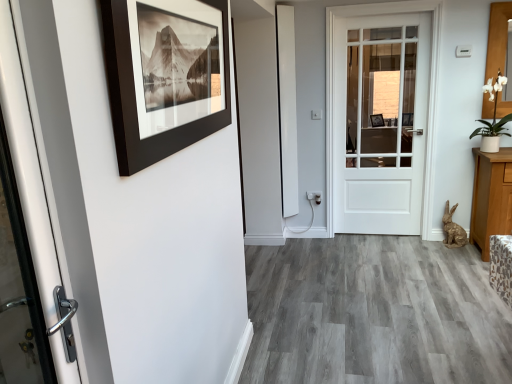
Question: From a real-world perspective, is white matte door at center located higher than black matte picture frame at upper left?

Choices:
 (A) yes
 (B) no

Answer: (B)

Question: Is white matte door at center facing away from black matte picture frame at upper left?

Choices:
 (A) yes
 (B) no

Answer: (B)

Question: Is white matte door at center bigger than black matte picture frame at upper left?

Choices:
 (A) no
 (B) yes

Answer: (B)

Question: Is the surface of white matte door at center in direct contact with black matte picture frame at upper left?

Choices:
 (A) no
 (B) yes

Answer: (A)

Question: Can you confirm if white matte door at center is taller than black matte picture frame at upper left?

Choices:
 (A) yes
 (B) no

Answer: (A)

Question: In terms of height, does white matte door at center look taller or shorter compared to white ceramic pot at upper right?

Choices:
 (A) tall
 (B) short

Answer: (A)

Question: Do you think white matte door at center is within white ceramic pot at upper right, or outside of it?

Choices:
 (A) inside
 (B) outside

Answer: (B)

Question: From the image's perspective, is white matte door at center positioned above or below white ceramic pot at upper right?

Choices:
 (A) below
 (B) above

Answer: (A)

Question: Is white matte door at center bigger or smaller than white ceramic pot at upper right?

Choices:
 (A) small
 (B) big

Answer: (B)

Question: From a real-world perspective, is white ceramic pot at upper right physically located above or below black matte picture frame at upper left?

Choices:
 (A) above
 (B) below

Answer: (B)

Question: Is white ceramic pot at upper right to the left or to the right of black matte picture frame at upper left in the image?

Choices:
 (A) left
 (B) right

Answer: (B)

Question: Is white ceramic pot at upper right in front of or behind black matte picture frame at upper left in the image?

Choices:
 (A) behind
 (B) front

Answer: (A)

Question: Considering the positions of white ceramic pot at upper right and black matte picture frame at upper left in the image, is white ceramic pot at upper right taller or shorter than black matte picture frame at upper left?

Choices:
 (A) short
 (B) tall

Answer: (B)

Question: Relative to black matte picture frame at upper left, is white matte door at center in front or behind?

Choices:
 (A) front
 (B) behind

Answer: (B)

Question: Based on their sizes in the image, would you say white matte door at center is bigger or smaller than black matte picture frame at upper left?

Choices:
 (A) big
 (B) small

Answer: (A)